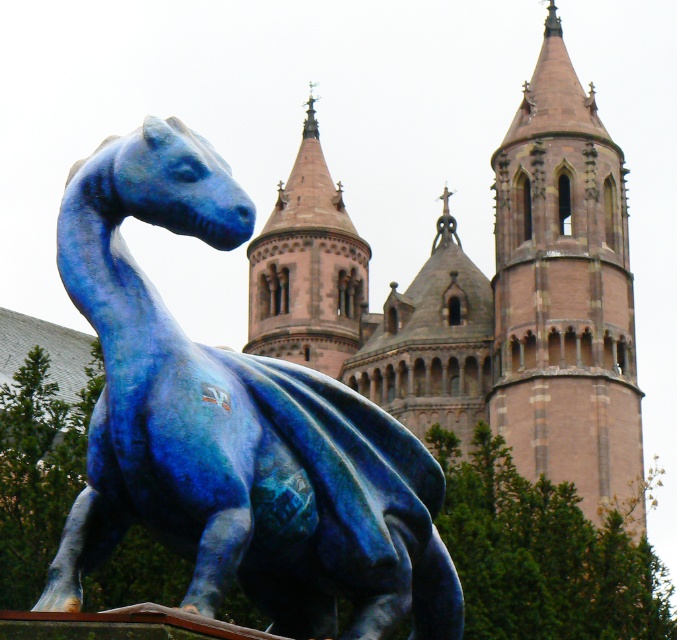
Who is positioned more to the right, blue glossy dragon at left or brown stone tower at center?

blue glossy dragon at left

Does blue glossy dragon at left have a lesser width compared to brown stone tower at center?

Correct, blue glossy dragon at left's width is less than brown stone tower at center's.

Who is more forward, [259,412] or [328,298]?

Point [259,412] is in front.

Locate an element on the screen. The height and width of the screenshot is (640, 677). blue glossy dragon at left is located at coordinates (234, 429).

Consider the image. Is brown stone tower at upper center below brown stone tower at center?

Yes.

Between brown stone tower at upper center and brown stone tower at center, which one appears on the left side from the viewer's perspective?

From the viewer's perspective, brown stone tower at center appears more on the left side.

Is point (605, 260) positioned in front of point (366, 337)?

Yes.

At what (x,y) coordinates should I click in order to perform the action: click on brown stone tower at upper center. Please return your answer as a coordinate pair (x, y). Looking at the image, I should click on (565, 296).

Can you confirm if blue glossy dragon at left is smaller than brown stone tower at upper center?

Yes, blue glossy dragon at left is smaller than brown stone tower at upper center.

Is blue glossy dragon at left above brown stone tower at upper center?

No, blue glossy dragon at left is not above brown stone tower at upper center.

Who is more distant from viewer, (320,496) or (588,118)?

The point (588,118) is more distant.

You are a GUI agent. You are given a task and a screenshot of the screen. Output one action in this format:
    pyautogui.click(x=<x>, y=<y>)
    Task: Click on the blue glossy dragon at left
    This screenshot has width=677, height=640.
    Given the screenshot: What is the action you would take?
    [234, 429]